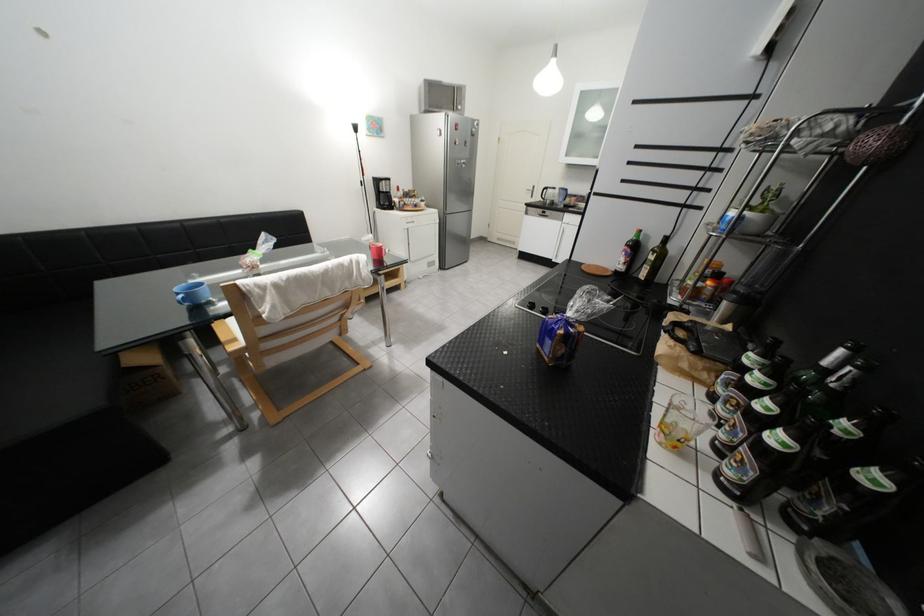
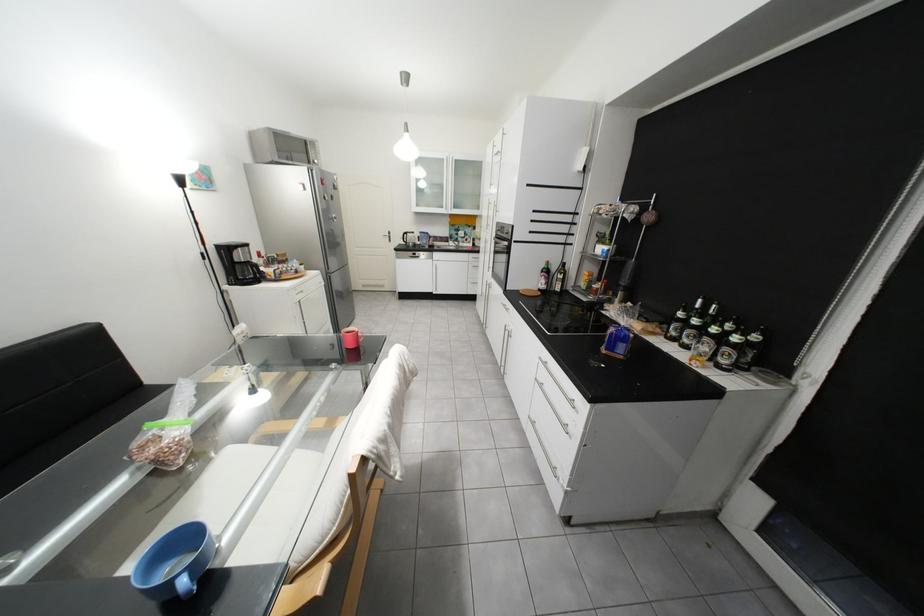
Find the pixel in the second image that matches point (393, 191) in the first image.

(249, 262)